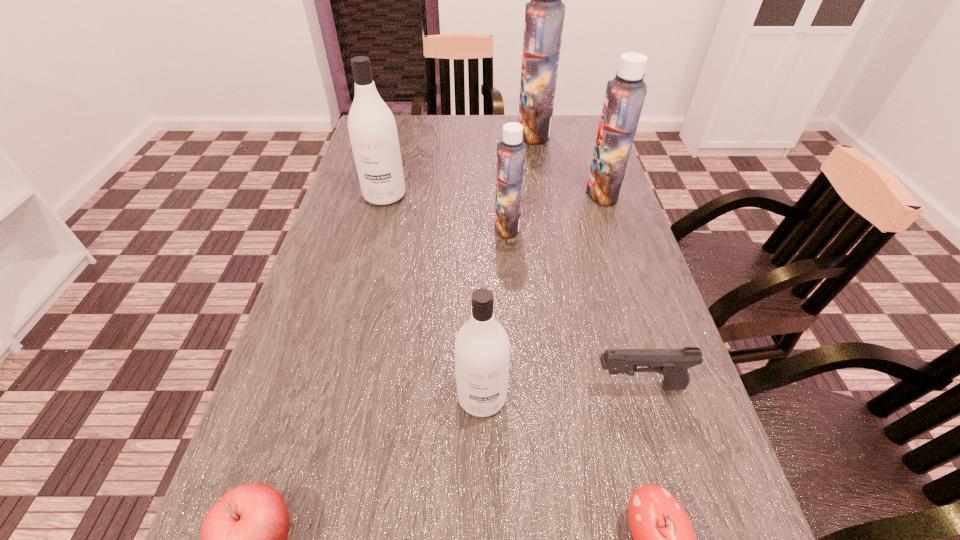
Locate an element on the screen. free spot located on the front label of the leftmost blue shampoo is located at coordinates (455, 226).

Identify the location of vacant area situated on the front-facing side of the nearest shampoo. This screenshot has width=960, height=540. (x=482, y=501).

This screenshot has width=960, height=540. What are the coordinates of `vacant space located 0.280m at the barrel of the pistol` in the screenshot? It's located at (440, 386).

Where is `vacant area situated at the barrel of the pistol`? This screenshot has height=540, width=960. vacant area situated at the barrel of the pistol is located at coordinates (494, 386).

This screenshot has height=540, width=960. I want to click on free space located at the barrel of the pistol, so click(401, 386).

Identify the location of object positioned at the far edge. (544, 15).

I want to click on object positioned at the left edge, so click(x=372, y=129).

Image resolution: width=960 pixels, height=540 pixels. Identify the location of pistol at the right edge. (673, 364).

The height and width of the screenshot is (540, 960). Find the location of `object at the far right corner`. object at the far right corner is located at coordinates [x=544, y=15].

The height and width of the screenshot is (540, 960). Find the location of `vacant space at the left edge`. vacant space at the left edge is located at coordinates (308, 509).